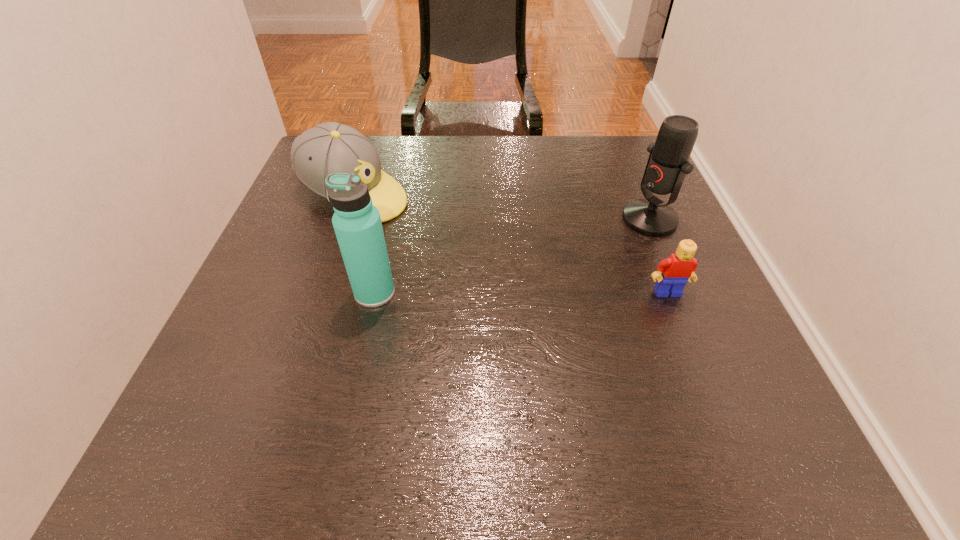
Where is `free spot between the baseball cap and the shortest object`? free spot between the baseball cap and the shortest object is located at coordinates pos(511,243).

Where is `free space that is in between the microphone and the baseball cap`? This screenshot has height=540, width=960. free space that is in between the microphone and the baseball cap is located at coordinates (502, 207).

Find the location of a particular element. empty space that is in between the second shortest object and the Lego is located at coordinates (511, 243).

At what (x,y) coordinates should I click in order to perform the action: click on object that stands as the closest to the second shortest object. Please return your answer as a coordinate pair (x, y). The height and width of the screenshot is (540, 960). Looking at the image, I should click on (357, 223).

The image size is (960, 540). I want to click on object that is the second closest to the microphone, so click(330, 147).

Locate an element on the screen. free space in the image that satisfies the following two spatial constraints: 1. on the front side of the microphone; 2. on the right side of the third tallest object is located at coordinates (346, 219).